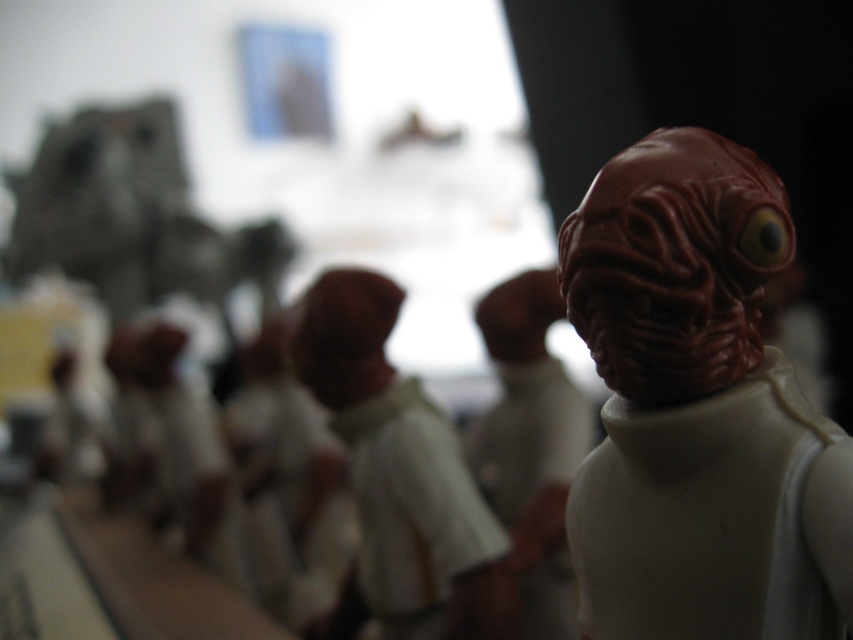
Is rubber-like brown alien head at right to the left of white matte figure at center from the viewer's perspective?

No, rubber-like brown alien head at right is not to the left of white matte figure at center.

Who is higher up, rubber-like brown alien head at right or white matte figure at center?

Positioned higher is rubber-like brown alien head at right.

Locate an element on the screen. Image resolution: width=853 pixels, height=640 pixels. rubber-like brown alien head at right is located at coordinates (698, 408).

Is white matte figure at center behind matte white figure at center?

No, white matte figure at center is in front of matte white figure at center.

Can you confirm if white matte figure at center is positioned above matte white figure at center?

Indeed, white matte figure at center is positioned over matte white figure at center.

Does point (399, 484) come farther from viewer compared to point (546, 320)?

That is False.

Identify the location of white matte figure at center. This screenshot has height=640, width=853. (398, 472).

Consider the image. Does rubber-like brown alien head at right have a smaller size compared to matte white figure at center?

Yes.

Looking at this image, between rubber-like brown alien head at right and matte white figure at center, which one is positioned lower?

matte white figure at center is lower down.

The width and height of the screenshot is (853, 640). I want to click on rubber-like brown alien head at right, so click(x=698, y=408).

Image resolution: width=853 pixels, height=640 pixels. I want to click on rubber-like brown alien head at right, so click(698, 408).